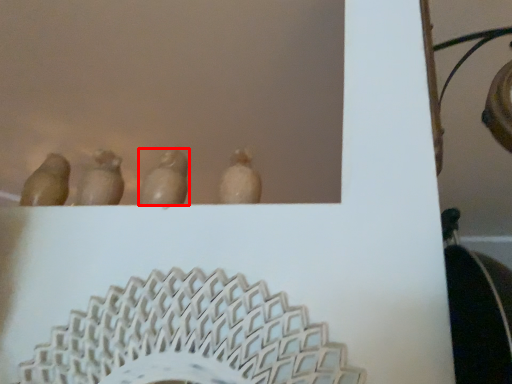
Question: In this image, where is animal (annotated by the red box) located relative to animal?

Choices:
 (A) right
 (B) left

Answer: (A)